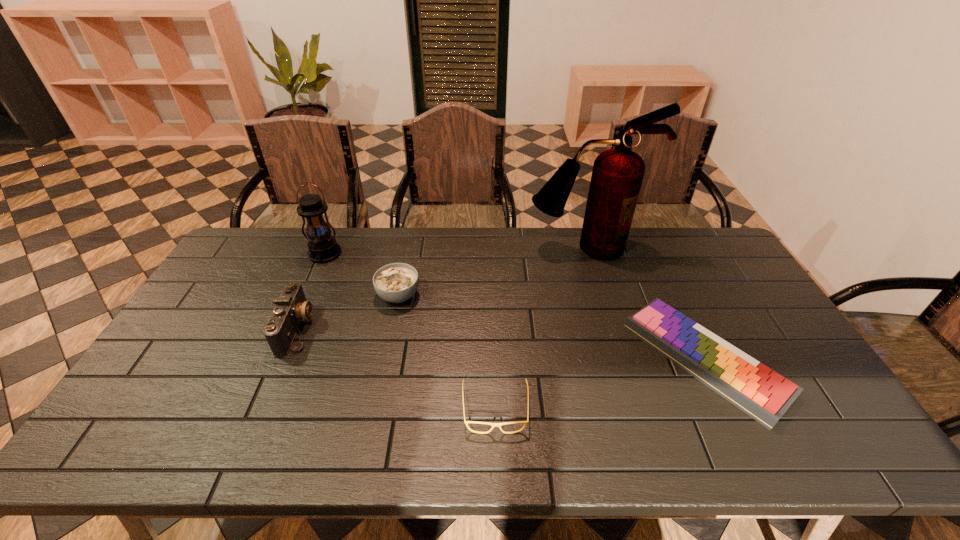
You are a GUI agent. You are given a task and a screenshot of the screen. Output one action in this format:
    pyautogui.click(x=<x>, y=<y>)
    Task: Click on the fire extinguisher
    
    Given the screenshot: What is the action you would take?
    pyautogui.click(x=617, y=175)

The width and height of the screenshot is (960, 540). Find the location of `lantern`. lantern is located at coordinates (322, 247).

Where is `the third tallest object`? The width and height of the screenshot is (960, 540). the third tallest object is located at coordinates (291, 308).

At what (x,y) coordinates should I click in order to perform the action: click on soup bowl. Please return your answer as a coordinate pair (x, y). The image size is (960, 540). Looking at the image, I should click on (397, 282).

The image size is (960, 540). Find the location of `the third object from left to right`. the third object from left to right is located at coordinates (397, 282).

At what (x,y) coordinates should I click in order to perform the action: click on computer keyboard. Please return your answer as a coordinate pair (x, y). Looking at the image, I should click on (762, 393).

You are a GUI agent. You are given a task and a screenshot of the screen. Output one action in this format:
    pyautogui.click(x=<x>, y=<y>)
    Task: Click on the spectacles
    The height and width of the screenshot is (540, 960).
    Given the screenshot: What is the action you would take?
    pyautogui.click(x=493, y=425)

The image size is (960, 540). Find the location of `free point located at the nozzle of the fire extinguisher`. free point located at the nozzle of the fire extinguisher is located at coordinates (596, 285).

Choose a point located above the lantern, indicating its light source in the vacant region. Please provide its 2D coordinates. Your answer should be formatted as a tuple, i.e. [(x, y)], where the tuple contains the x and y coordinates of a point satisfying the conditions above.

[(291, 332)]

Where is `free space located 0.130m on the front-facing side of the third tallest object`? This screenshot has width=960, height=540. free space located 0.130m on the front-facing side of the third tallest object is located at coordinates (357, 328).